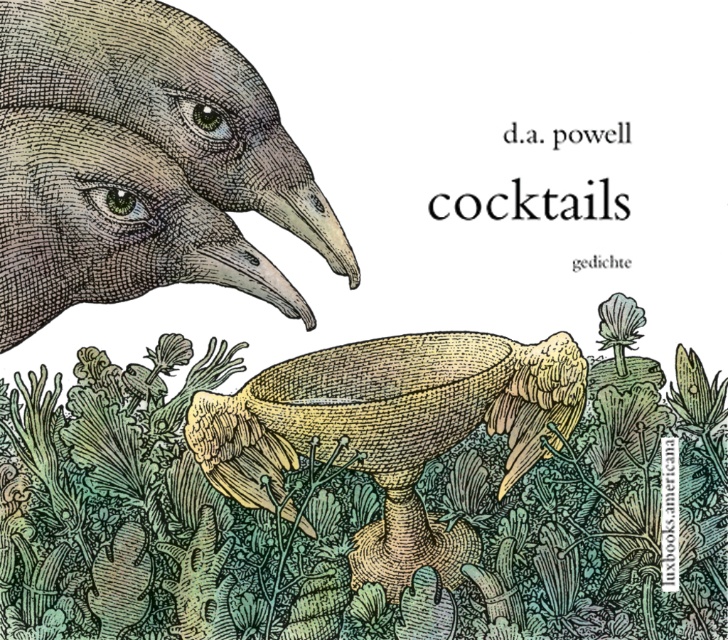
You are an interior designer looking at this book cover. You need to place a decorative item on a shelf. If the yellow woven basket at center is already there, where should you place the green textured plant at lower center relative to it?

The green textured plant at lower center should be placed to the left of the yellow woven basket at center.

Based on the scene described, which object is positioned higher in the image, the green textured plant at lower center or the brown textured bird head at upper left?

The brown textured bird head at upper left is positioned higher in the image than the green textured plant at lower center.

You are a book designer who needs to add a decorative ribbon between the green textured plant at lower center and the yellow woven basket at center. The ribbon is 1.5 inches long. Will the ribbon be long enough to stretch between them?

The green textured plant at lower center and yellow woven basket at center are 1.35 inches apart. Since the ribbon is 1.5 inches long, it will be long enough to stretch between them with a little extra length remaining.